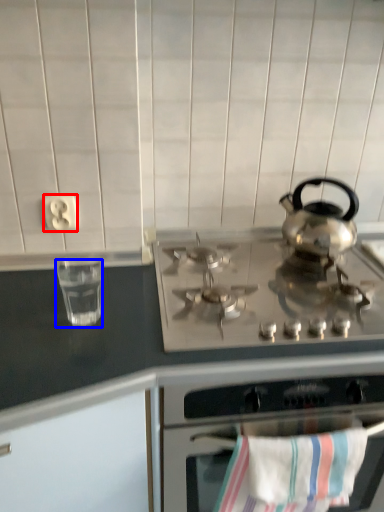
Question: Which object is closer to the camera taking this photo, electric outlet (highlighted by a red box) or appliance (highlighted by a blue box)?

Choices:
 (A) electric outlet
 (B) appliance

Answer: (B)